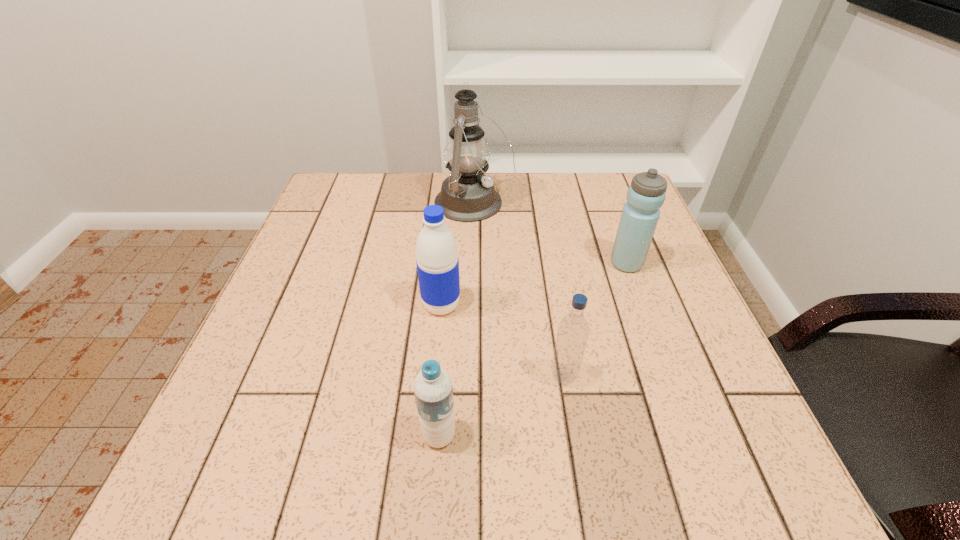
Locate an element on the screen. This screenshot has width=960, height=540. empty space that is in between the third farthest water bottle and the second farthest water bottle is located at coordinates (502, 341).

Find the location of a particular element. the closest object relative to the rightmost water bottle is located at coordinates (467, 195).

You are a GUI agent. You are given a task and a screenshot of the screen. Output one action in this format:
    pyautogui.click(x=<x>, y=<y>)
    Task: Click on the object that is the third closest to the third farthest object
    This screenshot has width=960, height=540.
    Given the screenshot: What is the action you would take?
    pyautogui.click(x=467, y=195)

Locate an element on the screen. the closest water bottle to the second object from right to left is located at coordinates (433, 389).

Identify the location of water bottle that is the second nearest to the second object from right to left. (437, 261).

The width and height of the screenshot is (960, 540). What are the coordinates of `vacant region that satisfies the following two spatial constraints: 1. on the front side of the third farthest water bottle; 2. on the right side of the farthest object` in the screenshot? It's located at coord(470,376).